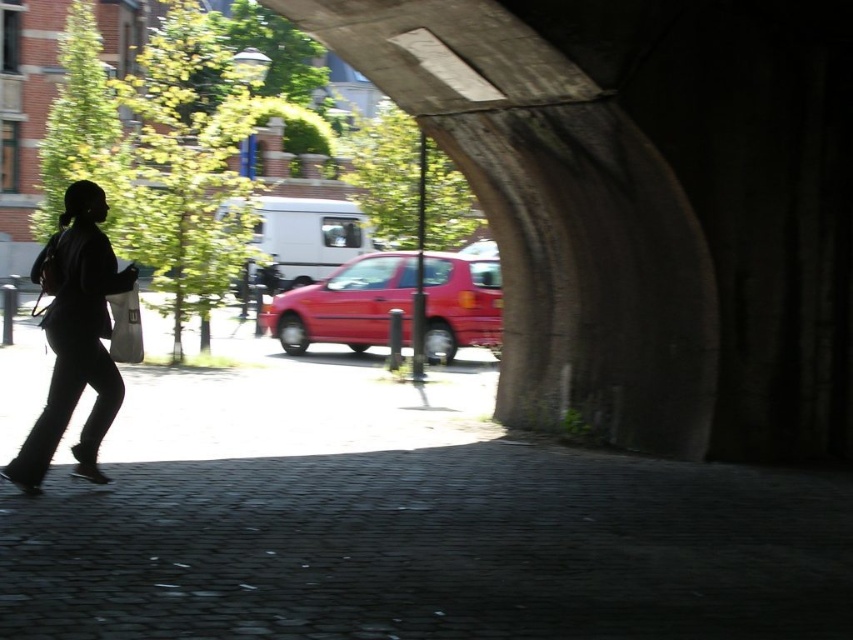
Question: Among these points, which one is farthest from the camera?

Choices:
 (A) (457, 296)
 (B) (78, 211)

Answer: (A)

Question: Which of the following is the closest to the observer?

Choices:
 (A) (67, 202)
 (B) (325, 326)

Answer: (A)

Question: Is black fabric bag at left below shiny red car at center?

Choices:
 (A) yes
 (B) no

Answer: (A)

Question: Which of the following is the closest to the observer?

Choices:
 (A) (352, 292)
 (B) (88, 180)

Answer: (B)

Question: Is black fabric bag at left positioned at the back of shiny red car at center?

Choices:
 (A) no
 (B) yes

Answer: (A)

Question: Is black fabric bag at left wider than shiny red car at center?

Choices:
 (A) no
 (B) yes

Answer: (A)